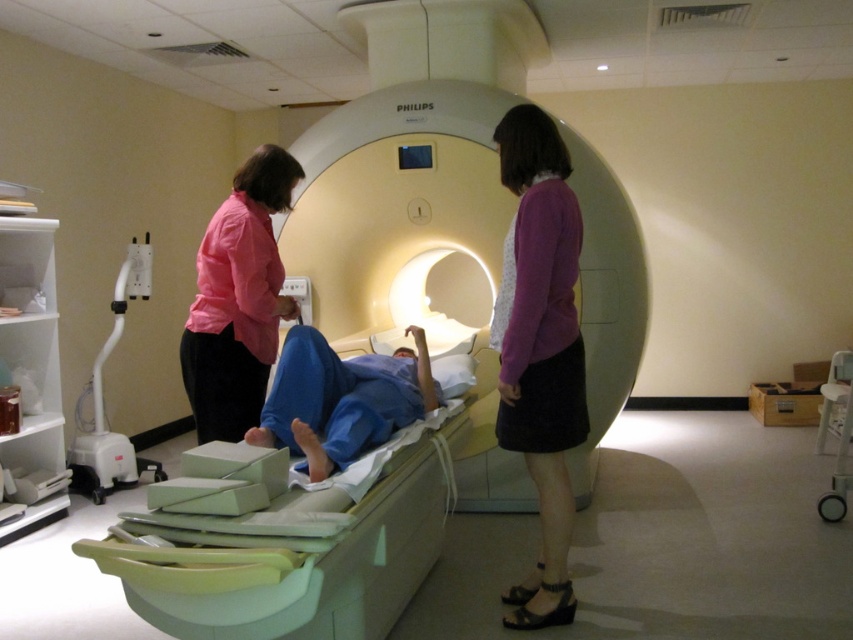
Is purple fabric skirt at center smaller than white plastic oxygen tank at left?

Indeed, purple fabric skirt at center has a smaller size compared to white plastic oxygen tank at left.

Is purple fabric skirt at center above white plastic oxygen tank at left?

Indeed, purple fabric skirt at center is positioned over white plastic oxygen tank at left.

Is point (564, 448) farther from viewer compared to point (117, 307)?

No, (564, 448) is in front of (117, 307).

Locate an element on the screen. The width and height of the screenshot is (853, 640). purple fabric skirt at center is located at coordinates (540, 348).

Measure the distance between point (544, 493) and camera.

The distance of point (544, 493) from camera is 8.46 feet.

Is purple fabric skirt at center smaller than white plastic cart at lower right?

Correct, purple fabric skirt at center occupies less space than white plastic cart at lower right.

At what (x,y) coordinates should I click in order to perform the action: click on purple fabric skirt at center. Please return your answer as a coordinate pair (x, y). Looking at the image, I should click on (540, 348).

Locate an element on the screen. purple fabric skirt at center is located at coordinates (540, 348).

Between pink fabric shirt at left and blue fabric at center, which one appears on the right side from the viewer's perspective?

From the viewer's perspective, blue fabric at center appears more on the right side.

Is pink fabric shirt at left to the left of blue fabric at center from the viewer's perspective?

Correct, you'll find pink fabric shirt at left to the left of blue fabric at center.

Is point (231, 346) in front of point (421, 371)?

Yes, point (231, 346) is closer to viewer.

Find the location of a particular element. The width and height of the screenshot is (853, 640). pink fabric shirt at left is located at coordinates (238, 300).